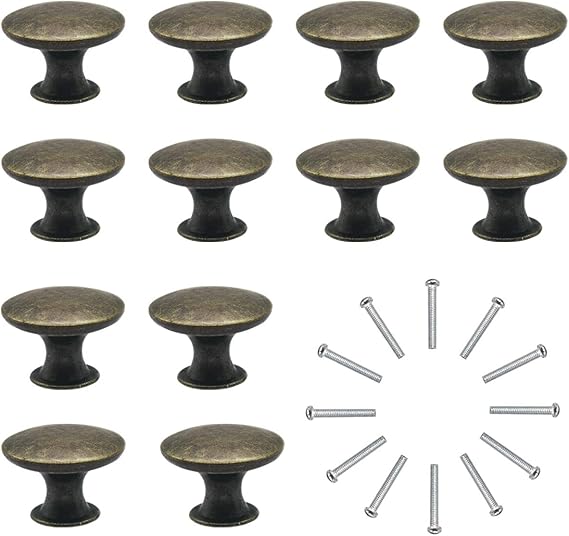
This screenshot has width=569, height=536. Find the location of `four knobs on top rown`. four knobs on top rown is located at coordinates (511, 28), (362, 39), (74, 33), (212, 29).